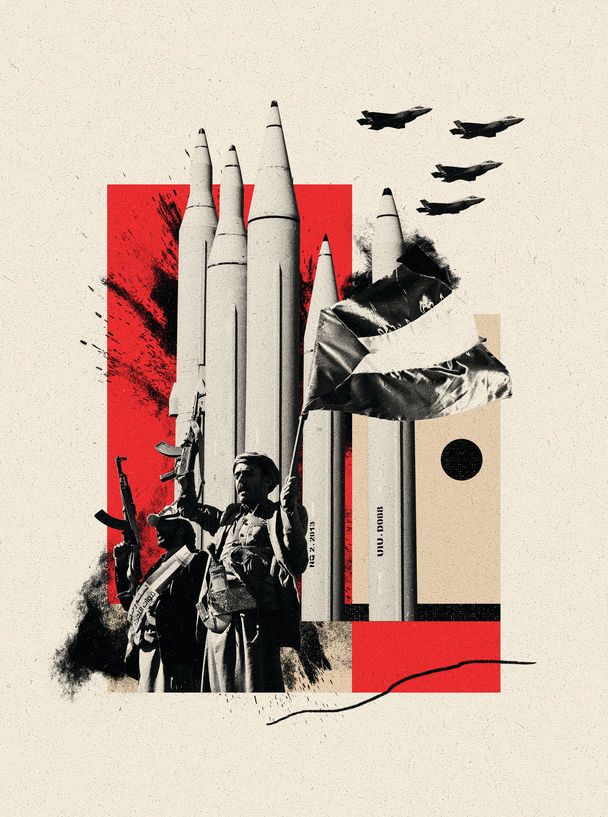
The height and width of the screenshot is (817, 608). Find the location of `poster`. poster is located at coordinates (216, 404).